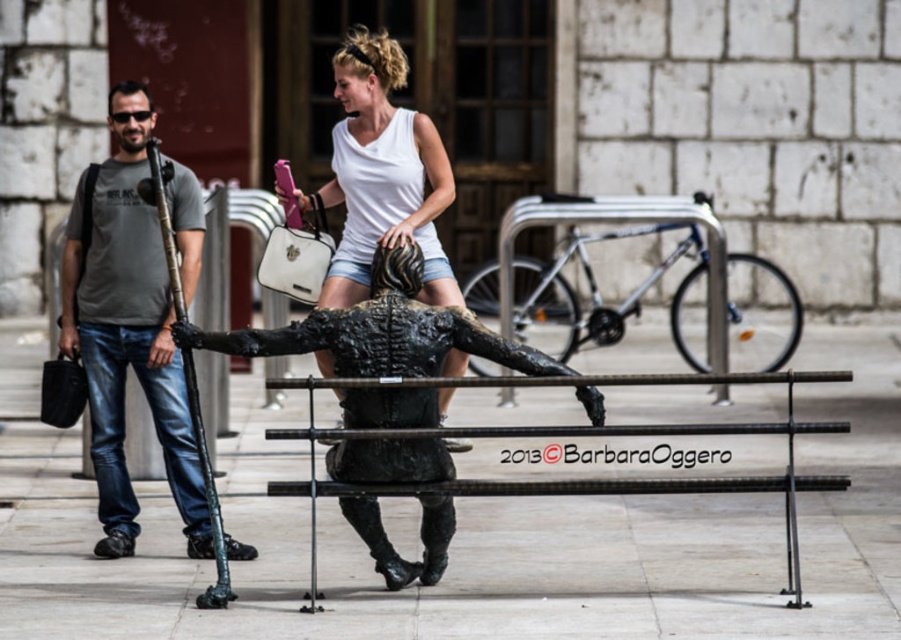
You are a photographer trying to capture both the black matte bronze sculpture at center and the white matte tank top at center in a single frame. Since you want to emphasize the size difference between them, which object should you position closer to the camera?

The black matte bronze sculpture at center is smaller than the white matte tank top at center, so to emphasize their size difference, you should position the black matte bronze sculpture at center closer to the camera.

You are an artist planning to place a new artwork between the black matte bronze sculpture at center and the white matte tank top at center. Given their widths, which object should you place the artwork closer to to ensure it fits better?

The black matte bronze sculpture at center has a lesser width compared to the white matte tank top at center, so placing the artwork closer to the black matte bronze sculpture at center would allow more space for the artwork to fit better.

You are a photographer trying to capture both the white matte tank top at center and the black metal bench at center in a single frame. Given their sizes, which object should you focus on to ensure both are visible without cropping?

The white matte tank top at center is bigger than the black metal bench at center, so you should focus on the white matte tank top at center to ensure both objects are visible without cropping.